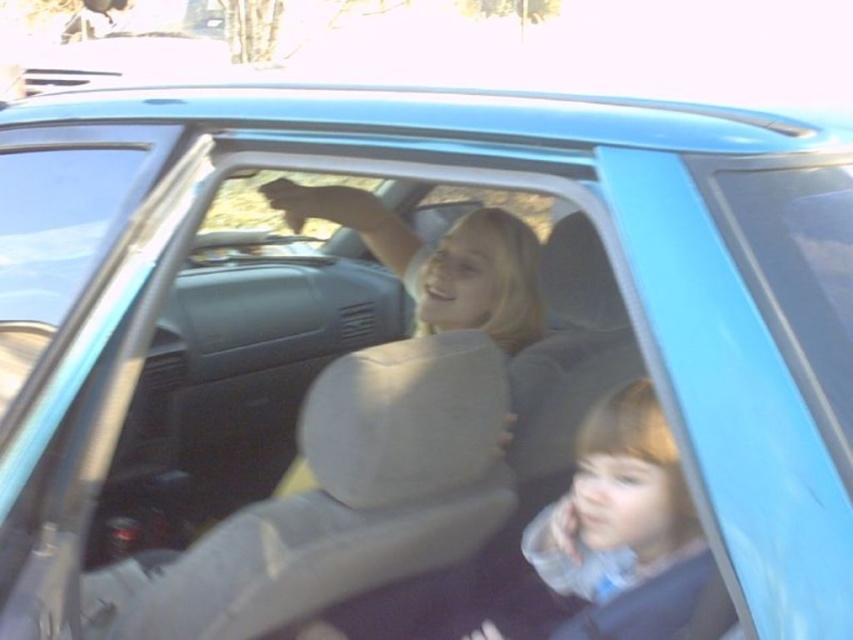
Does smooth beige baby at center lie behind light beige leather seat at center?

No, it is not.

Can you confirm if smooth beige baby at center is wider than light beige leather seat at center?

No.

Which is in front, point (554, 524) or point (494, 212)?

Point (554, 524) is more forward.

The image size is (853, 640). Identify the location of smooth beige baby at center. (616, 502).